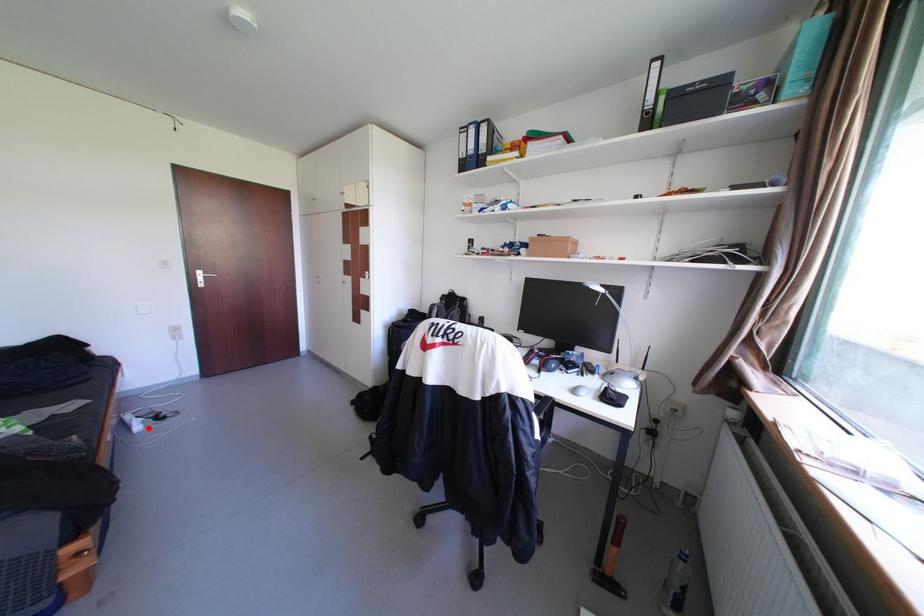
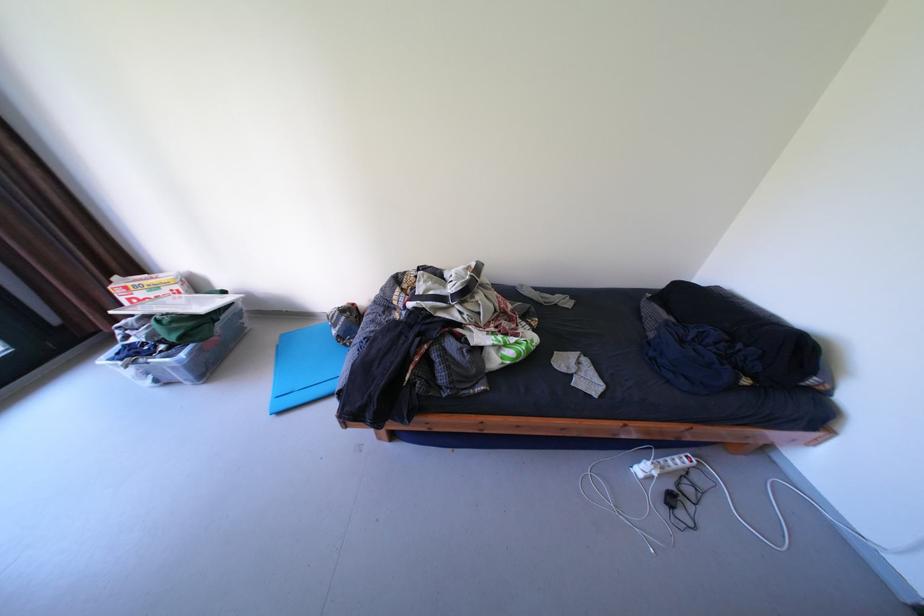
In the second image, find the point that corresponds to the highlighted location in the first image.

(649, 471)